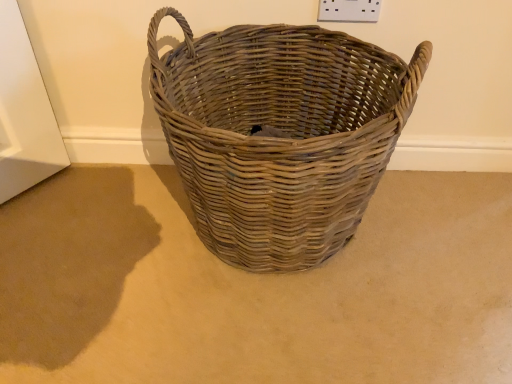
Question: From a real-world perspective, is natural woven basket at center on top of natural wicker basket at center?

Choices:
 (A) no
 (B) yes

Answer: (B)

Question: Is natural woven basket at center bigger than natural wicker basket at center?

Choices:
 (A) no
 (B) yes

Answer: (B)

Question: Considering the relative positions of natural woven basket at center and natural wicker basket at center in the image provided, is natural woven basket at center in front of natural wicker basket at center?

Choices:
 (A) no
 (B) yes

Answer: (B)

Question: Is natural woven basket at center at the left side of natural wicker basket at center?

Choices:
 (A) yes
 (B) no

Answer: (B)

Question: Would you say natural woven basket at center is a long distance from natural wicker basket at center?

Choices:
 (A) yes
 (B) no

Answer: (B)

Question: Is natural woven basket at center behind natural wicker basket at center?

Choices:
 (A) no
 (B) yes

Answer: (A)

Question: Does natural wicker basket at center have a larger size compared to natural woven basket at center?

Choices:
 (A) no
 (B) yes

Answer: (A)

Question: From the image's perspective, does natural wicker basket at center appear lower than natural woven basket at center?

Choices:
 (A) yes
 (B) no

Answer: (A)

Question: From a real-world perspective, is natural wicker basket at center physically above natural woven basket at center?

Choices:
 (A) no
 (B) yes

Answer: (A)

Question: Is natural wicker basket at center to the right of natural woven basket at center from the viewer's perspective?

Choices:
 (A) no
 (B) yes

Answer: (A)

Question: Is natural wicker basket at center facing towards natural woven basket at center?

Choices:
 (A) yes
 (B) no

Answer: (B)

Question: Is natural wicker basket at center smaller than natural woven basket at center?

Choices:
 (A) no
 (B) yes

Answer: (B)

Question: In the image, is natural wicker basket at center on the left side or the right side of natural woven basket at center?

Choices:
 (A) right
 (B) left

Answer: (B)